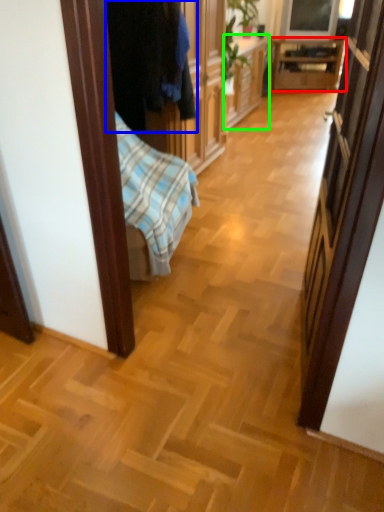
Question: Considering the real-world distances, which object is closest to table (highlighted by a red box)? clothing (highlighted by a blue box) or cabinetry (highlighted by a green box).

Choices:
 (A) clothing
 (B) cabinetry

Answer: (B)